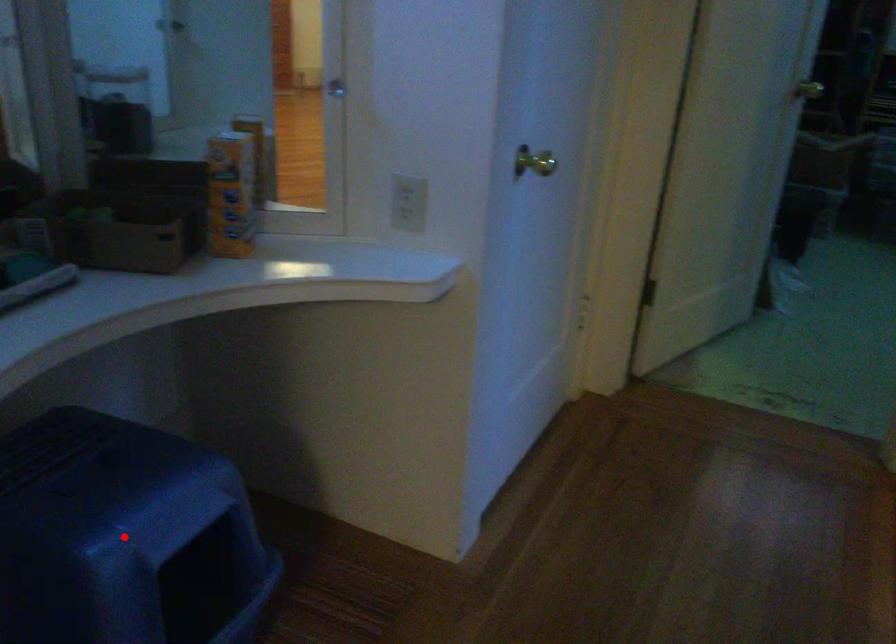
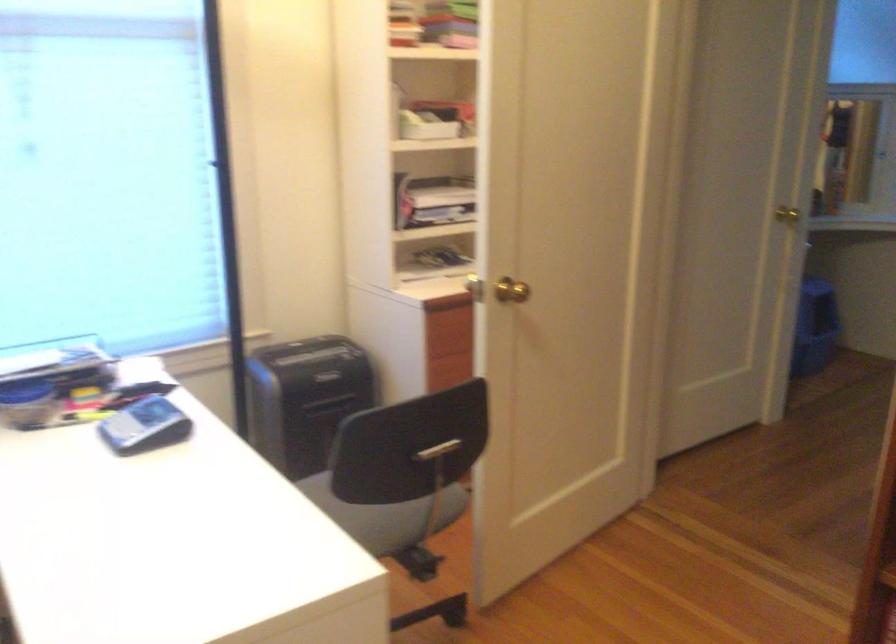
Question: I am providing you with two images of the same scene from different viewpoints. A red point is marked on the first image. Is the red point's position out of view in image 2?

Choices:
 (A) Yes
 (B) No

Answer: (A)